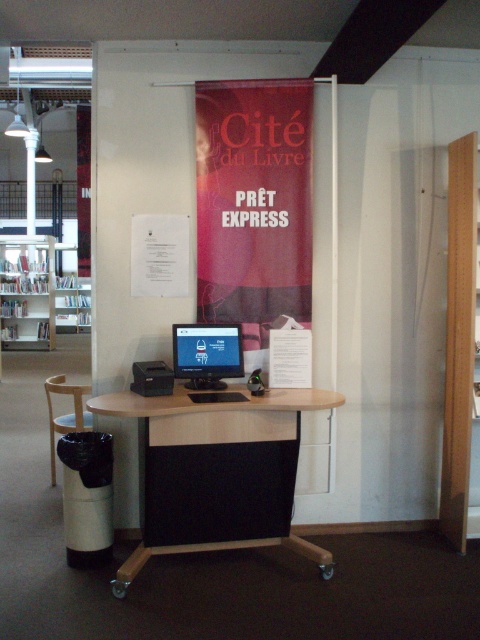
Question: Which point is closer to the camera?

Choices:
 (A) wooden chair at lower left
 (B) matte black monitor at center

Answer: (B)

Question: Is matte black monitor at center positioned before wooden chair at lower left?

Choices:
 (A) no
 (B) yes

Answer: (B)

Question: Is wooden desk at center closer to camera compared to metallic silver bookshelf at left?

Choices:
 (A) no
 (B) yes

Answer: (B)

Question: Which of the following is the closest to the observer?

Choices:
 (A) (216, 324)
 (B) (3, 236)
 (C) (206, 486)
 (D) (277, 189)

Answer: (C)

Question: Which object is the closest to the metallic silver bookshelf at left?

Choices:
 (A) wooden chair at lower left
 (B) matte black monitor at center
 (C) matte red banner at center

Answer: (A)

Question: Where is wooden desk at center located in relation to matte black monitor at center in the image?

Choices:
 (A) left
 (B) right

Answer: (B)